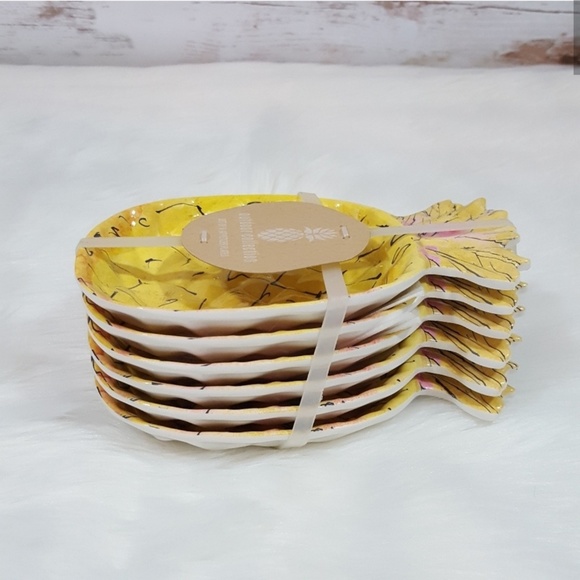
Locate an element on the screen. The image size is (580, 580). pineapple shaped plate is located at coordinates (194, 306), (209, 334), (201, 360), (218, 386), (233, 411), (229, 438).